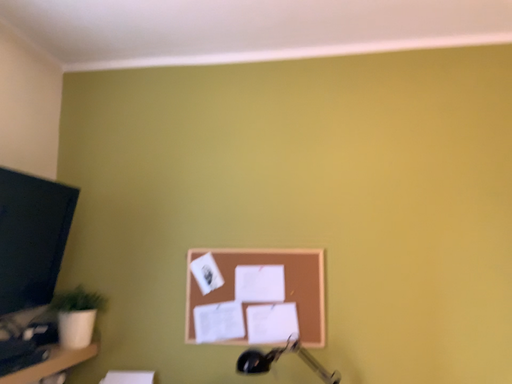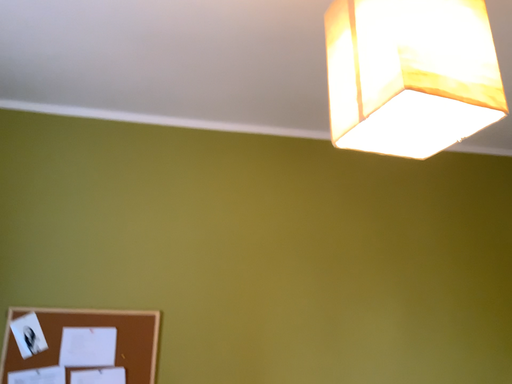
Question: How did the camera likely rotate when shooting the video?

Choices:
 (A) rotated left
 (B) rotated right

Answer: (B)